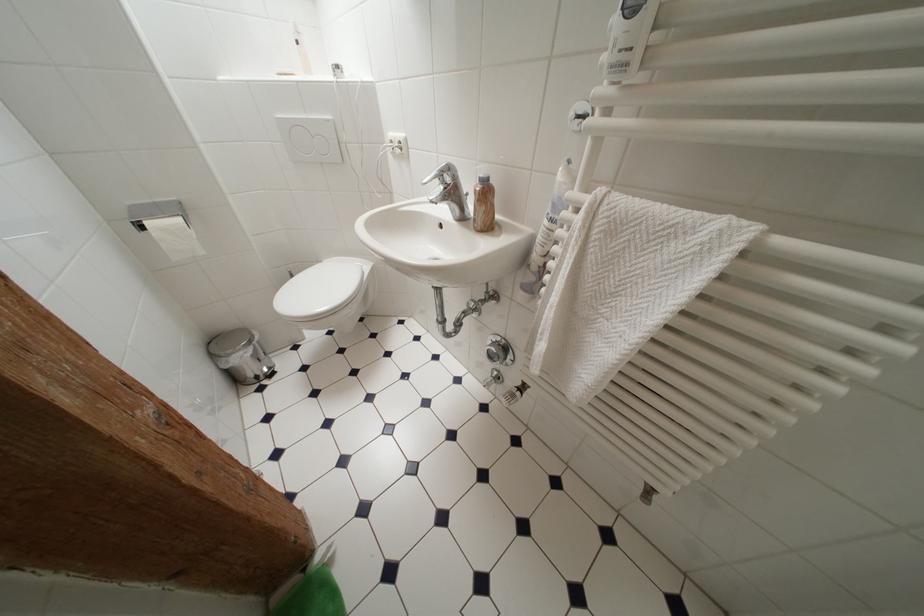
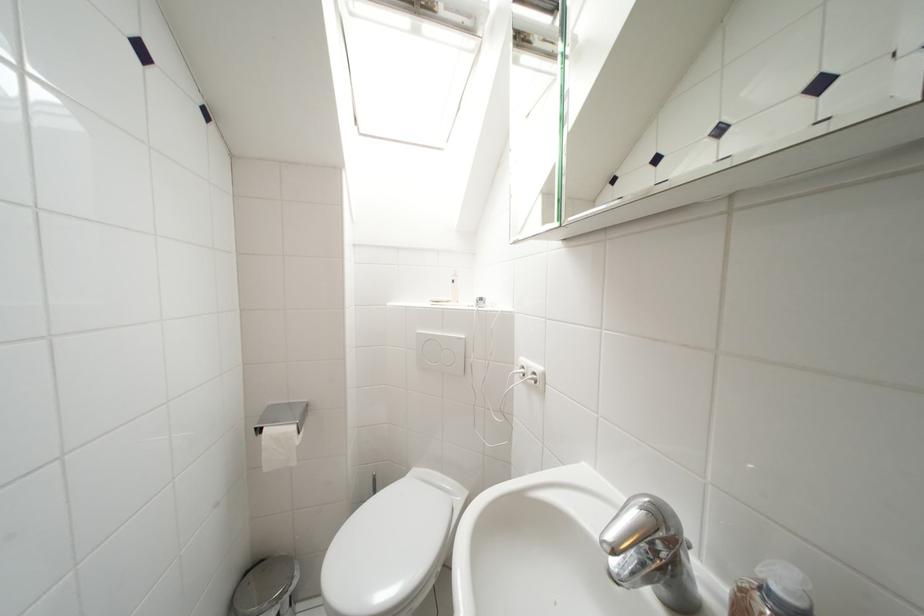
Find the pixel in the second image that matches the point at 160,219 in the first image.

(283, 424)